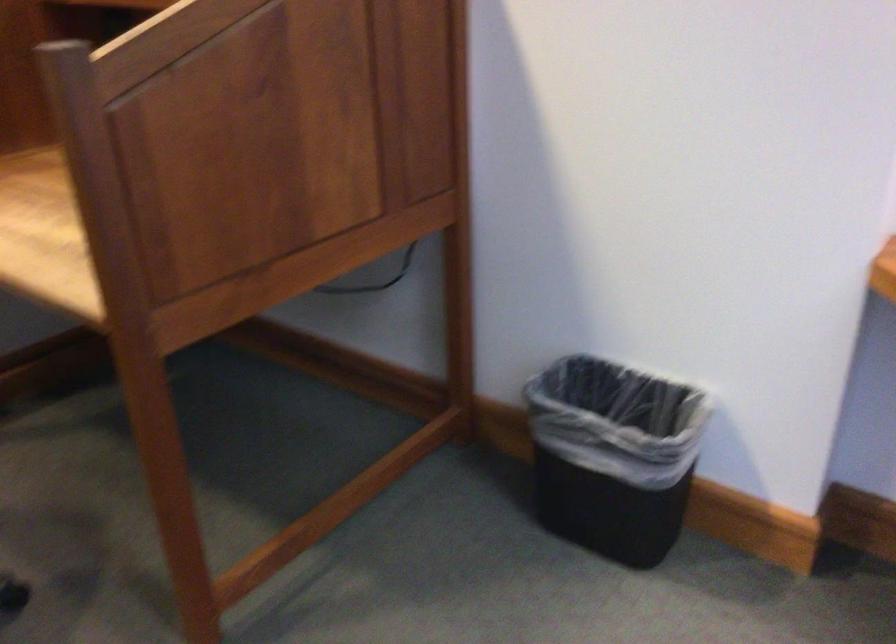
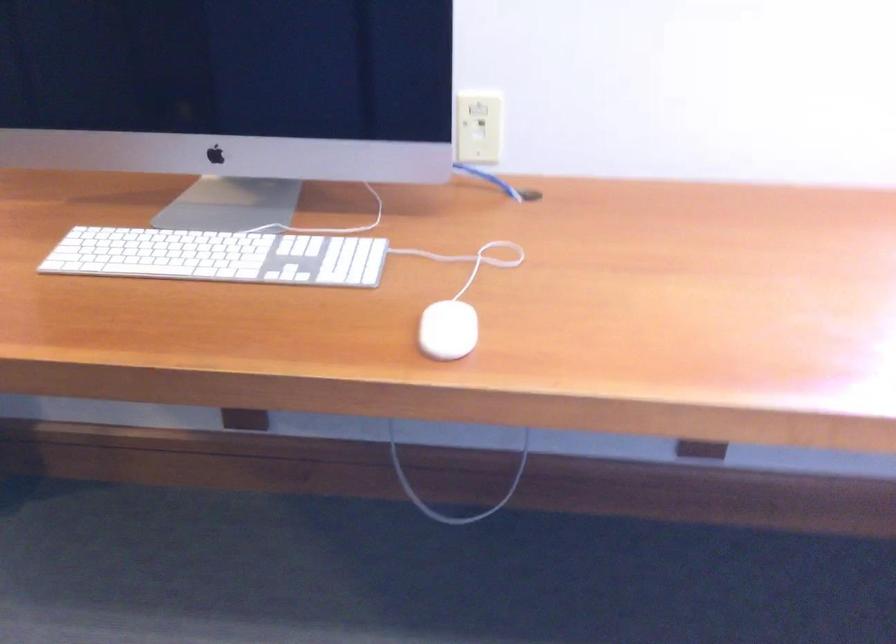
Question: How did the camera likely rotate?

Choices:
 (A) Left
 (B) Right
 (C) Up
 (D) Down

Answer: (B)